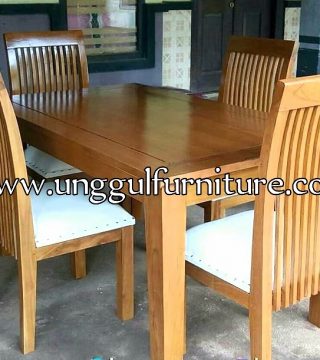
Image resolution: width=320 pixels, height=360 pixels. What are the coordinates of `picture` in the screenshot? It's located at (121, 20).